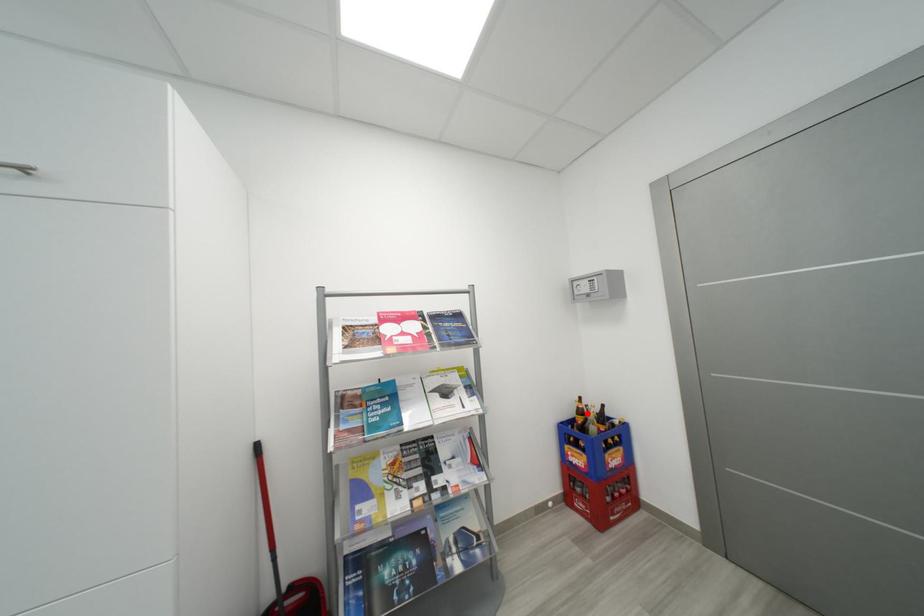
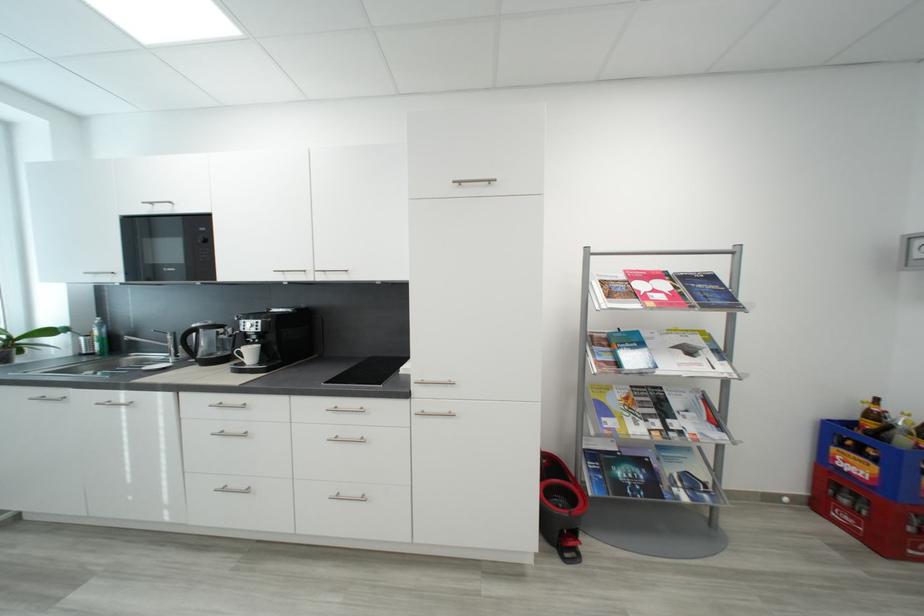
The point at the highlighted location is marked in the first image. Where is the corresponding point in the second image?

(881, 418)